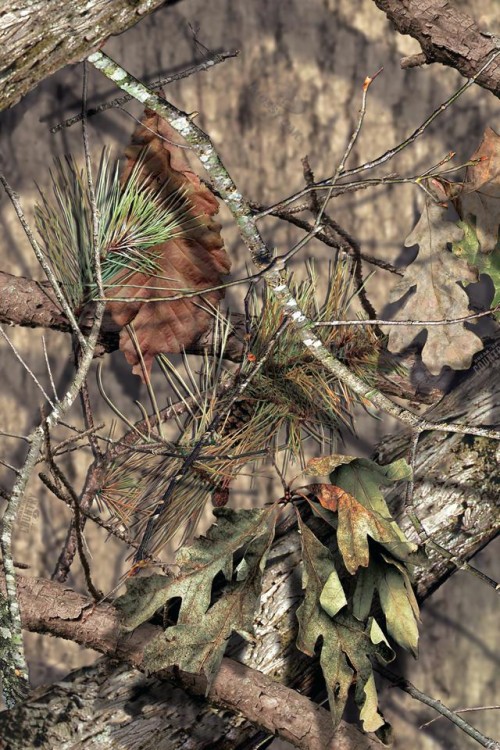
Locate an element on the screen. Image resolution: width=500 pixels, height=750 pixels. wall is located at coordinates (324, 92).